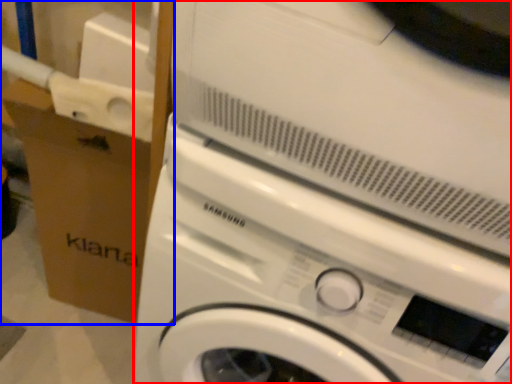
Question: Which point is closer to the camera, washing machine (highlighted by a red box) or cardboard box (highlighted by a blue box)?

Choices:
 (A) washing machine
 (B) cardboard box

Answer: (A)